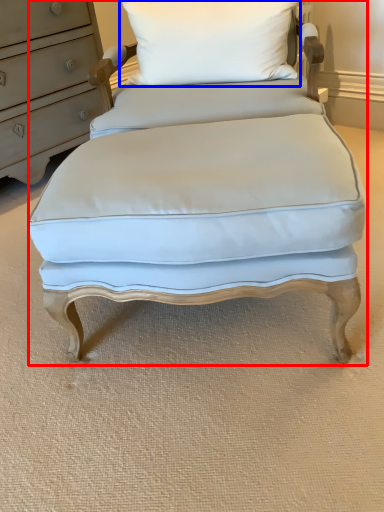
Question: Among these objects, which one is nearest to the camera, swivel chair (highlighted by a red box) or pillow (highlighted by a blue box)?

Choices:
 (A) swivel chair
 (B) pillow

Answer: (A)